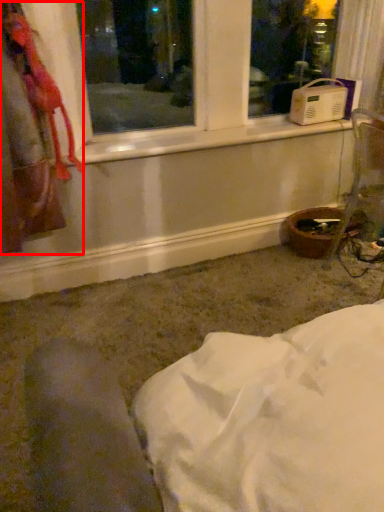
Question: In this image, where is laundry (annotated by the red box) located relative to bay window?

Choices:
 (A) right
 (B) left

Answer: (B)